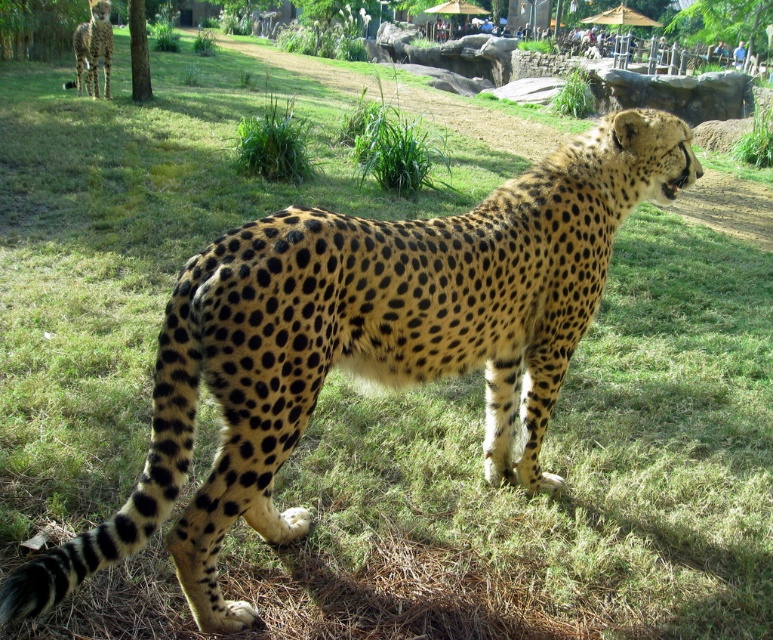
You are a zookeeper planning to place a new feeding station between the spotted fur cheetah at upper left and the green leafy tree at upper left. Based on their sizes, which object should the feeding station be closer to?

The spotted fur cheetah at upper left is larger than the green leafy tree at upper left. Therefore, the feeding station should be placed closer to the green leafy tree at upper left to ensure it is accessible and not overshadowed by the larger cheetah.

You are a zookeeper trying to locate two specific points in the cheetah enclosure. The first point is at coordinates point (758, 26) and the second is at point (107, 88). Which point is closer to the camera?

Point (107, 88) is closer to the camera because the Objects Description states that point (758, 26) is further to the camera than point (107, 88).